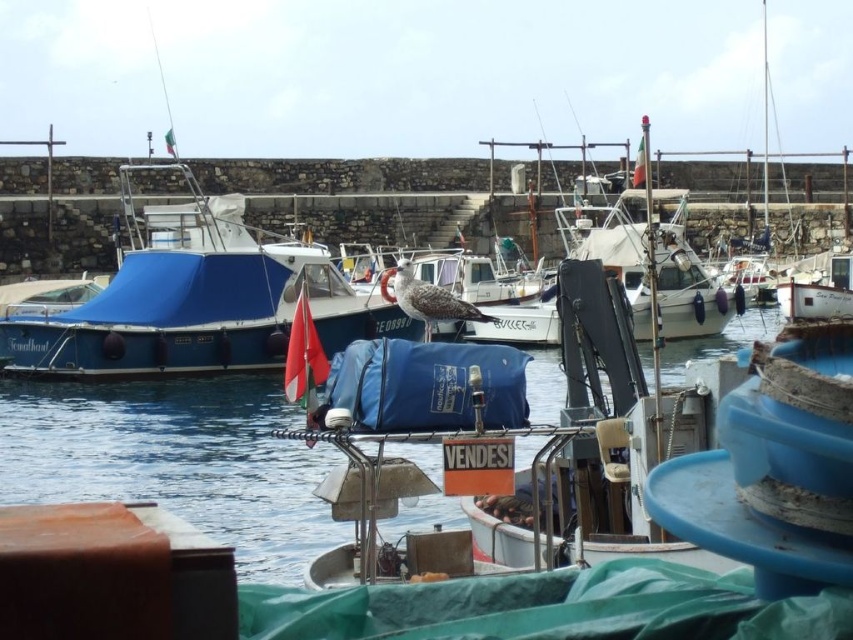
You are a photographer planning to capture the blue tarpaulin boat at left and the blue water at center in a single frame. Based on their sizes, which one will appear larger in your photo?

The blue tarpaulin boat at left will appear larger in the photo since it has a bigger size than the blue water at center according to the description.

You are a birdwatcher observing the scene from the pier. You notice the blue tarpaulin boat at left and the gray feathered seagull at center. Which object is positioned higher in the image?

The blue tarpaulin boat at left is located above the gray feathered seagull at center, so it is positioned higher in the image.

You are standing on the pier and see the blue water at center and the gray feathered seagull at center. Which one is located to the right of the other?

The blue water at center is positioned on the right side of gray feathered seagull at center.